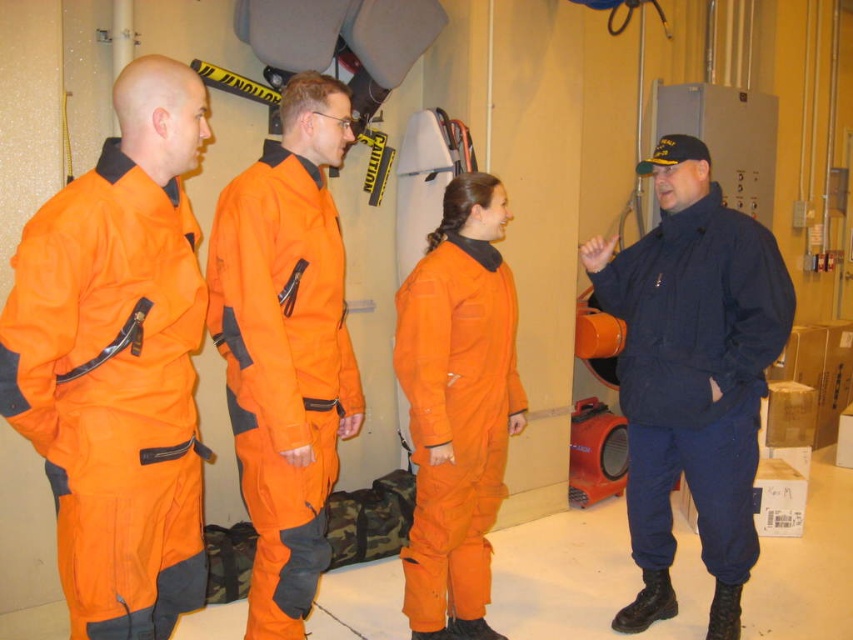
Consider the image. You are standing in the industrial setting described. You need to locate the navy blue uniform at right. Where exactly is it positioned in terms of coordinates?

The navy blue uniform at right is positioned at coordinates point [692,376].

You are standing in the industrial setting shown in the image. You need to move from point (84, 540) to point (701, 145). Which direction should you move to get closer to your destination?

Since point (84, 540) is closer to the viewer than point (701, 145), you should move backward to get closer to your destination.

You are a safety inspector in this industrial setting. You need to ensure that the orange matte jumpsuit at left and the navy blue uniform at right are visible from the main entrance. Considering their widths, which uniform might be harder to see from a distance and why?

The orange matte jumpsuit at left has a lesser width compared to the navy blue uniform at right. Since the navy blue uniform at right is wider, it might be more visible from a distance, making the orange matte jumpsuit at left potentially harder to see due to its smaller size.